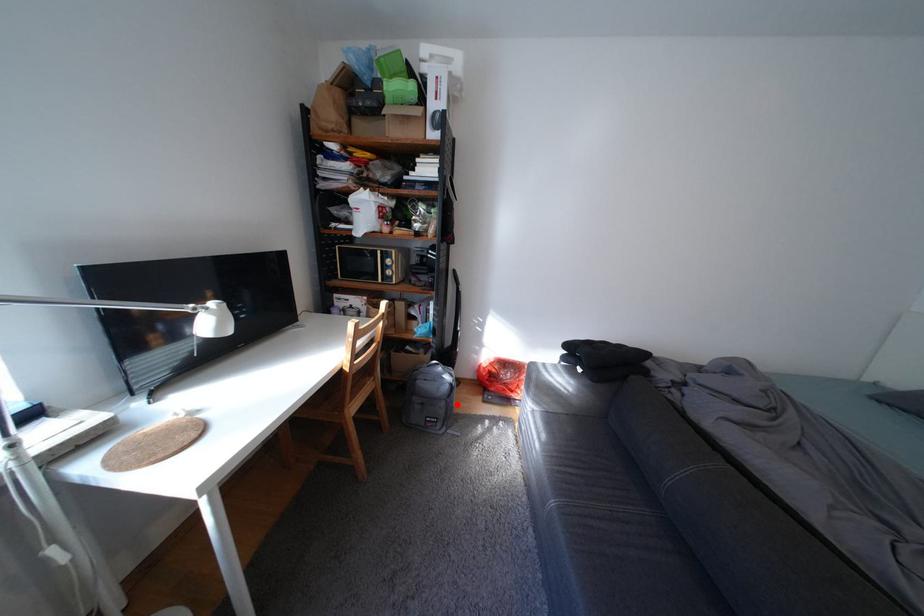
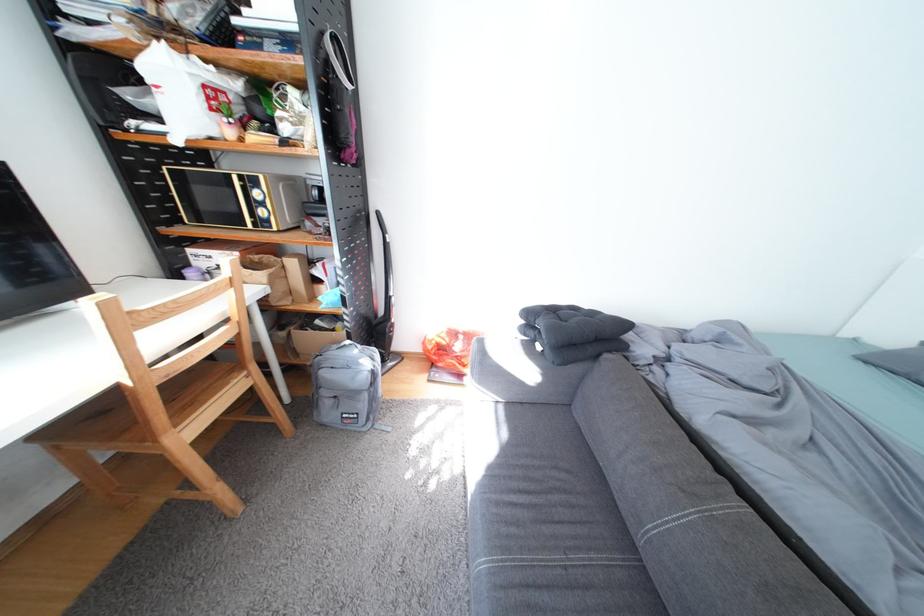
Question: I am providing you with two images of the same scene from different viewpoints. Given a red point in image1, look at the same physical point in image2. Is it:

Choices:
 (A) Closer to the viewpoint
 (B) Farther from the viewpoint

Answer: (A)